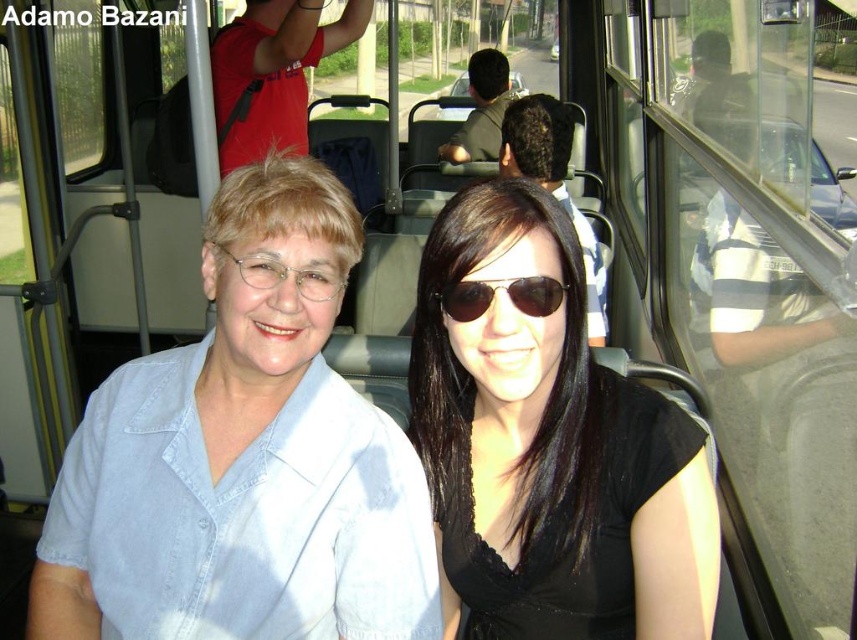
You are a photographer taking a photo of the two people seated in the bus. The point at coordinates (553, 180) is important for focusing. Which part of the person on the right should you focus on to ensure the point is on their dark brown hair at center?

The point at coordinates (553, 180) is on the dark brown hair at center of the person on the right, so focusing on their dark brown hair at center will ensure the point is correctly captured.